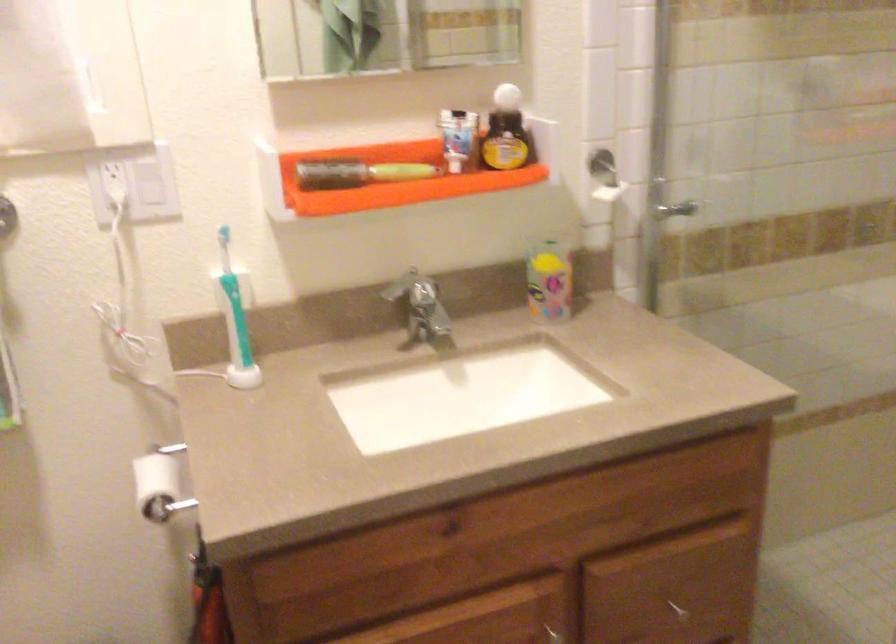
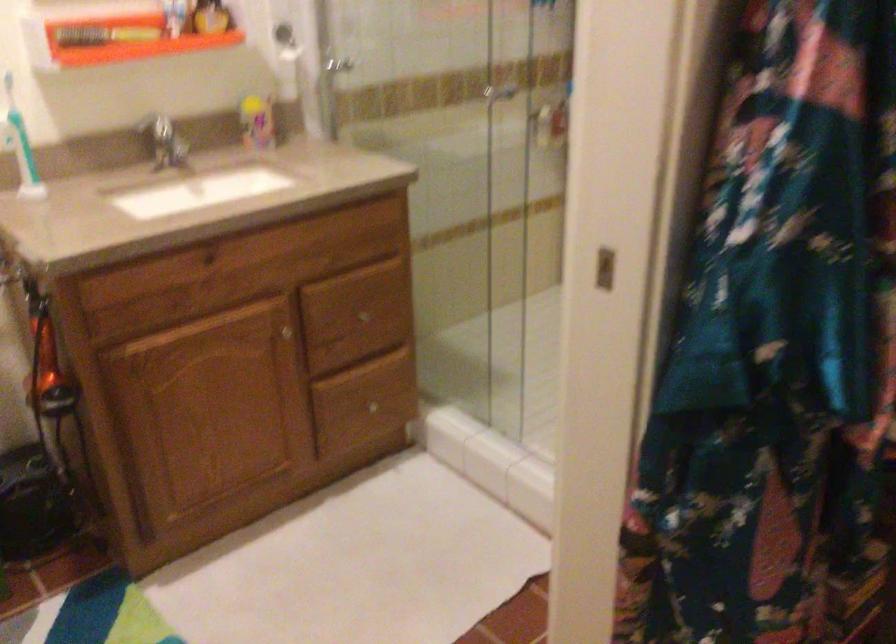
Question: In a continuous first-person perspective shot, in which direction is the camera moving?

Choices:
 (A) Left
 (B) Right
 (C) Forward
 (D) Backward

Answer: (D)